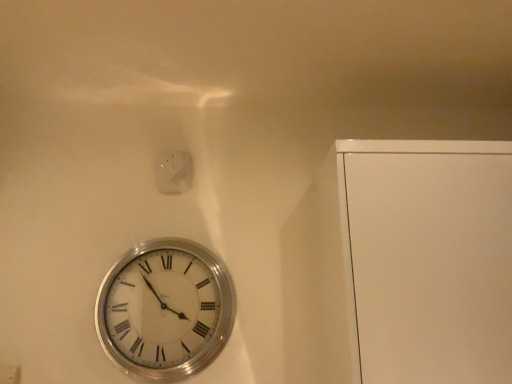
Question: Is silver metallic clock at lower left aimed at white glossy electric outlet at upper center?

Choices:
 (A) yes
 (B) no

Answer: (B)

Question: Can you confirm if silver metallic clock at lower left is bigger than white glossy electric outlet at upper center?

Choices:
 (A) no
 (B) yes

Answer: (B)

Question: From the image's perspective, is silver metallic clock at lower left below white glossy electric outlet at upper center?

Choices:
 (A) no
 (B) yes

Answer: (B)

Question: Is silver metallic clock at lower left positioned before white glossy electric outlet at upper center?

Choices:
 (A) yes
 (B) no

Answer: (A)

Question: From a real-world perspective, is silver metallic clock at lower left physically above white glossy electric outlet at upper center?

Choices:
 (A) no
 (B) yes

Answer: (A)

Question: Is silver metallic clock at lower left smaller than white glossy electric outlet at upper center?

Choices:
 (A) no
 (B) yes

Answer: (A)

Question: Is white glossy electric outlet at upper center bigger than silver metallic clock at lower left?

Choices:
 (A) yes
 (B) no

Answer: (B)

Question: Is white glossy electric outlet at upper center positioned with its back to silver metallic clock at lower left?

Choices:
 (A) no
 (B) yes

Answer: (A)

Question: Is white glossy electric outlet at upper center touching silver metallic clock at lower left?

Choices:
 (A) yes
 (B) no

Answer: (B)

Question: From a real-world perspective, is white glossy electric outlet at upper center positioned over silver metallic clock at lower left based on gravity?

Choices:
 (A) no
 (B) yes

Answer: (B)

Question: Does white glossy electric outlet at upper center have a greater width compared to silver metallic clock at lower left?

Choices:
 (A) yes
 (B) no

Answer: (B)

Question: Is white glossy electric outlet at upper center aimed at silver metallic clock at lower left?

Choices:
 (A) no
 (B) yes

Answer: (A)

Question: In terms of size, does white glossy electric outlet at upper center appear bigger or smaller than silver metallic clock at lower left?

Choices:
 (A) small
 (B) big

Answer: (A)